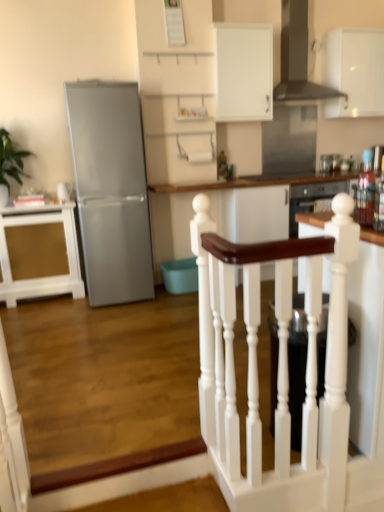
Where is `free space in front of gold textured cabinet at left, the 1th cabinetry from the left`? This screenshot has height=512, width=384. free space in front of gold textured cabinet at left, the 1th cabinetry from the left is located at coordinates (33, 317).